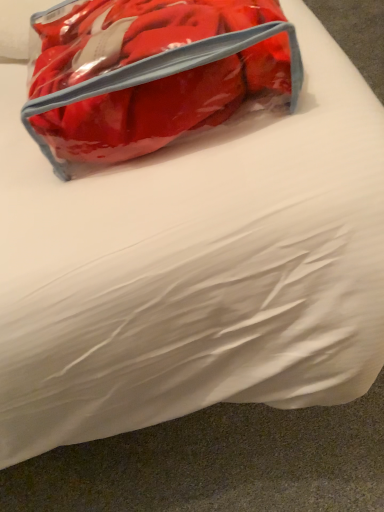
What do you see at coordinates (152, 73) in the screenshot?
I see `glossy plastic pouch at upper left` at bounding box center [152, 73].

Where is `glossy plastic pouch at upper left`? The width and height of the screenshot is (384, 512). glossy plastic pouch at upper left is located at coordinates (152, 73).

Find the location of a particular element. The image size is (384, 512). glossy plastic pouch at upper left is located at coordinates (152, 73).